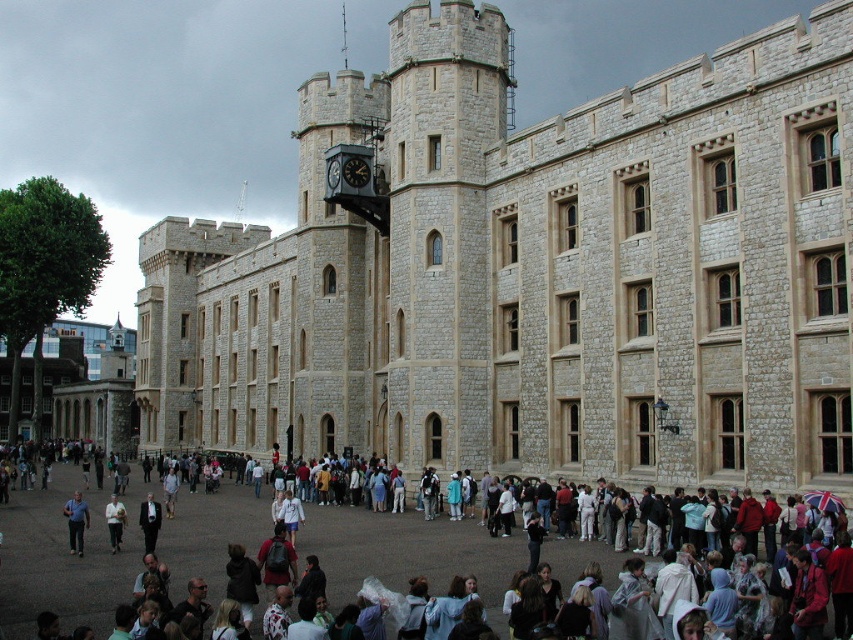
Is point (45, 550) positioned after point (74, 502)?

Yes, point (45, 550) is farther from viewer.

This screenshot has width=853, height=640. Find the location of `white cotton shirt at center`. white cotton shirt at center is located at coordinates (62, 557).

Does blue shirt at center have a smaller size compared to light gray fabric jacket at lower left?

No.

This screenshot has height=640, width=853. Find the location of `blue shirt at center`. blue shirt at center is located at coordinates click(x=76, y=522).

The image size is (853, 640). Describe the element at coordinates (76, 522) in the screenshot. I see `blue shirt at center` at that location.

You are a GUI agent. You are given a task and a screenshot of the screen. Output one action in this format:
    pyautogui.click(x=<x>, y=<y>)
    Task: Click on the blue shirt at center
    This screenshot has width=853, height=640.
    Given the screenshot: What is the action you would take?
    pyautogui.click(x=76, y=522)

How far apart are dark suit at center and light gray fabric jacket at lower left?

A distance of 5.69 feet exists between dark suit at center and light gray fabric jacket at lower left.

Is point (155, 515) positioned behind point (112, 509)?

No, (155, 515) is in front of (112, 509).

Locate an element on the screen. The width and height of the screenshot is (853, 640). dark suit at center is located at coordinates (149, 522).